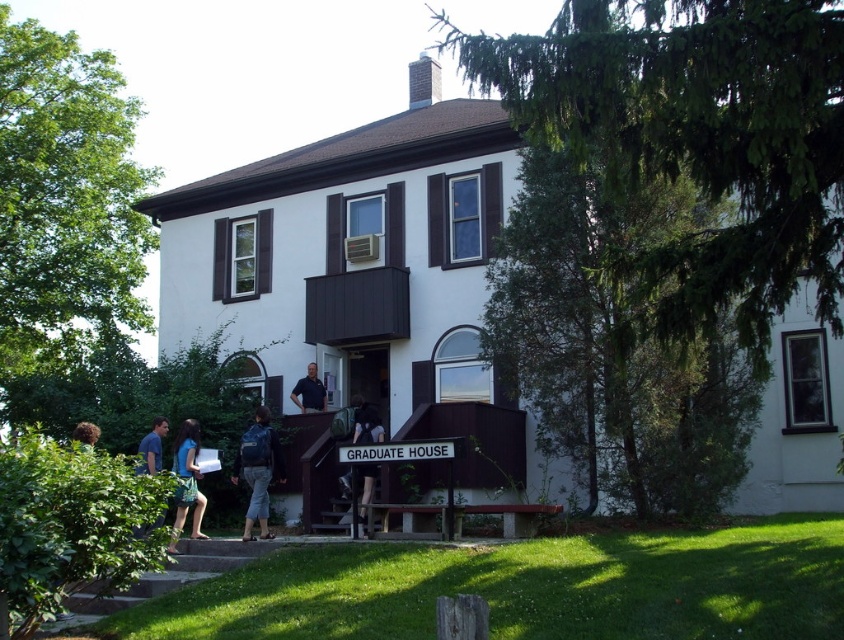
Can you confirm if dark blue shirt at center is smaller than curly brown hair at lower left?

Yes.

What do you see at coordinates (309, 392) in the screenshot? I see `dark blue shirt at center` at bounding box center [309, 392].

This screenshot has width=844, height=640. Find the location of `dark blue shirt at center`. dark blue shirt at center is located at coordinates (309, 392).

Who is more forward, (244, 465) or (371, 474)?

Point (244, 465)

Can you confirm if denim pants at center is shorter than dark blue backpack at center?

Indeed, denim pants at center has a lesser height compared to dark blue backpack at center.

Does point (252, 493) come behind point (366, 440)?

No, (252, 493) is in front of (366, 440).

At what (x,y) coordinates should I click in order to perform the action: click on denim pants at center. Please return your answer as a coordinate pair (x, y). This screenshot has height=640, width=844. Looking at the image, I should click on (258, 468).

Can you confirm if denim pants at center is taller than blue fabric dress at lower left?

In fact, denim pants at center may be shorter than blue fabric dress at lower left.

The image size is (844, 640). What do you see at coordinates (258, 468) in the screenshot?
I see `denim pants at center` at bounding box center [258, 468].

Where is `denim pants at center`? The image size is (844, 640). denim pants at center is located at coordinates (258, 468).